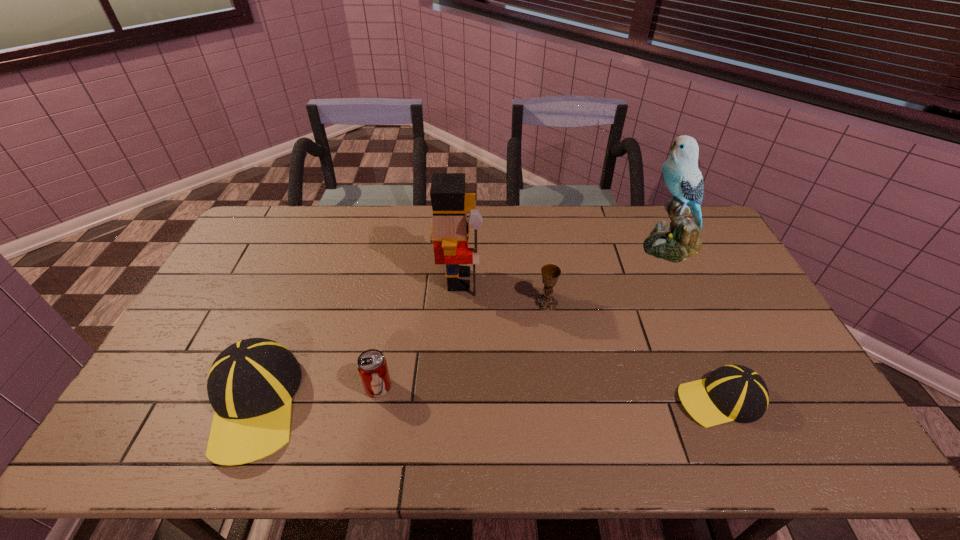
Where is `the leftmost object`? The height and width of the screenshot is (540, 960). the leftmost object is located at coordinates [250, 385].

At what (x,y) coordinates should I click in order to perform the action: click on the left baseball cap. Please return your answer as a coordinate pair (x, y). Looking at the image, I should click on (250, 385).

Where is `the shortest object`? This screenshot has height=540, width=960. the shortest object is located at coordinates click(x=730, y=393).

The height and width of the screenshot is (540, 960). What are the coordinates of `the right baseball cap` in the screenshot? It's located at (730, 393).

You are a GUI agent. You are given a task and a screenshot of the screen. Output one action in this format:
    pyautogui.click(x=<x>, y=<y>)
    Task: Click on the parakeet
    
    Given the screenshot: What is the action you would take?
    pyautogui.click(x=680, y=240)

The width and height of the screenshot is (960, 540). What are the coordinates of `chalice` in the screenshot? It's located at (550, 273).

In order to click on the third object from left to right in this screenshot , I will do `click(450, 231)`.

The image size is (960, 540). I want to click on pop soda, so click(x=372, y=366).

Identify the location of the fifth tallest object. The width and height of the screenshot is (960, 540). (372, 366).

Locate an element on the screen. The height and width of the screenshot is (540, 960). blank space located with the brim of the shorter baseball cap facing forward is located at coordinates point(641,399).